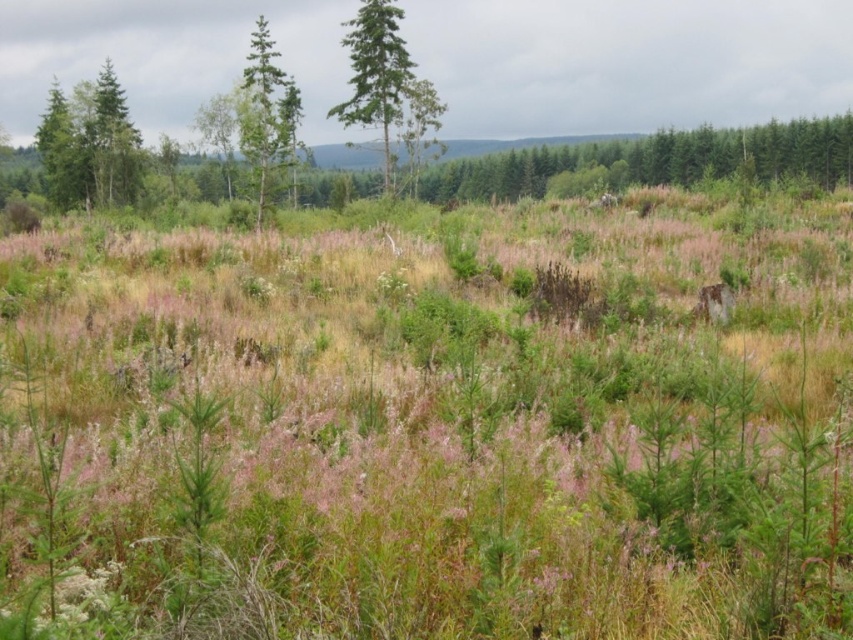
Is green matte tree at center to the left of green matte tree at left from the viewer's perspective?

No, green matte tree at center is not to the left of green matte tree at left.

Is green matte tree at center further to the viewer compared to green matte tree at left?

No, green matte tree at center is closer to the viewer.

Who is more distant from viewer, (258, 97) or (113, 140)?

The point (113, 140) is more distant.

In order to click on green matte tree at center in this screenshot , I will do `click(260, 113)`.

Between point (416, 92) and point (119, 148), which one is positioned in front?

Positioned in front is point (416, 92).

Who is higher up, green textured tree at center or green matte tree at left?

green textured tree at center

Where is `green textured tree at center`? green textured tree at center is located at coordinates (387, 88).

Is point (128, 136) in front of point (78, 186)?

Yes, it is.

Can you confirm if green matte tree at left is bigger than green matte tree at upper left?

Incorrect, green matte tree at left is not larger than green matte tree at upper left.

Is point (108, 84) positioned after point (62, 189)?

That is True.

The height and width of the screenshot is (640, 853). I want to click on green matte tree at left, so click(112, 141).